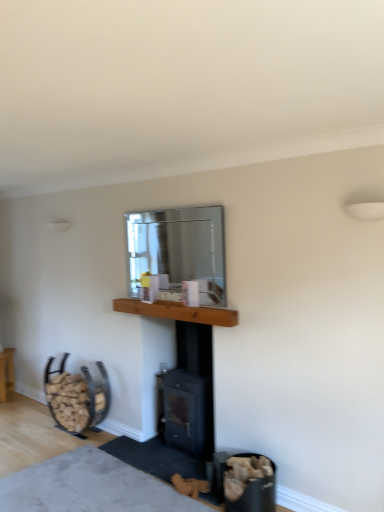
Question: Can you confirm if clear glass mirror at upper center is shorter than soft gray carpet at lower center?

Choices:
 (A) yes
 (B) no

Answer: (B)

Question: Is clear glass mirror at upper center positioned with its back to soft gray carpet at lower center?

Choices:
 (A) no
 (B) yes

Answer: (A)

Question: Can you confirm if clear glass mirror at upper center is thinner than soft gray carpet at lower center?

Choices:
 (A) no
 (B) yes

Answer: (B)

Question: From a real-world perspective, does clear glass mirror at upper center sit lower than soft gray carpet at lower center?

Choices:
 (A) no
 (B) yes

Answer: (A)

Question: Considering the relative positions of clear glass mirror at upper center and soft gray carpet at lower center in the image provided, is clear glass mirror at upper center behind soft gray carpet at lower center?

Choices:
 (A) no
 (B) yes

Answer: (B)

Question: From a real-world perspective, is wooden log basket at lower left positioned above or below clear glass mirror at upper center?

Choices:
 (A) above
 (B) below

Answer: (B)

Question: Considering their positions, is wooden log basket at lower left located in front of or behind clear glass mirror at upper center?

Choices:
 (A) behind
 (B) front

Answer: (A)

Question: Considering the positions of point (8, 379) and point (211, 289), is point (8, 379) closer or farther from the camera than point (211, 289)?

Choices:
 (A) farther
 (B) closer

Answer: (A)

Question: Would you say wooden log basket at lower left is to the left or to the right of clear glass mirror at upper center in the picture?

Choices:
 (A) left
 (B) right

Answer: (A)

Question: Considering the positions of clear glass mirror at upper center and soft gray carpet at lower center in the image, is clear glass mirror at upper center wider or thinner than soft gray carpet at lower center?

Choices:
 (A) wide
 (B) thin

Answer: (B)

Question: Is point (205, 216) positioned closer to the camera than point (51, 480)?

Choices:
 (A) closer
 (B) farther

Answer: (B)

Question: From their relative heights in the image, would you say clear glass mirror at upper center is taller or shorter than soft gray carpet at lower center?

Choices:
 (A) tall
 (B) short

Answer: (A)

Question: Based on their positions, is clear glass mirror at upper center located to the left or right of soft gray carpet at lower center?

Choices:
 (A) left
 (B) right

Answer: (B)

Question: From the image's perspective, is wooden at left positioned above or below wooden log basket at lower left?

Choices:
 (A) below
 (B) above

Answer: (B)

Question: Looking at the image, does wooden at left seem bigger or smaller compared to wooden log basket at lower left?

Choices:
 (A) big
 (B) small

Answer: (A)